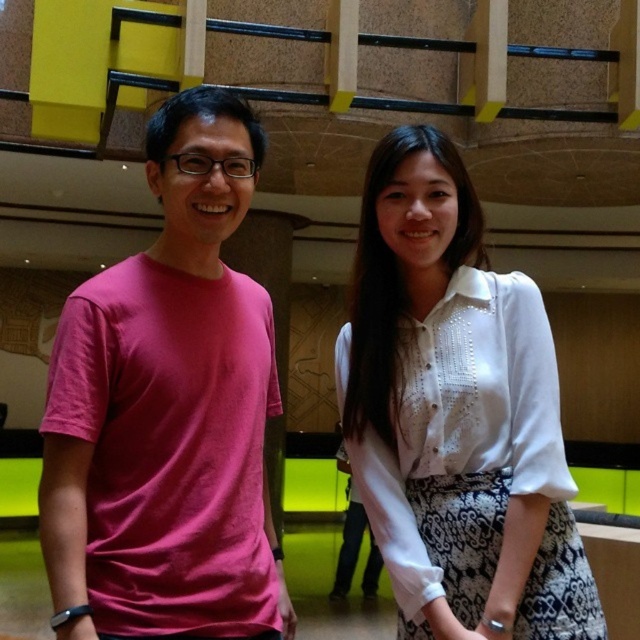
Question: Can you confirm if pink matte t-shirt at left is wider than white textured blouse at center?

Choices:
 (A) yes
 (B) no

Answer: (B)

Question: Which object is closer to the camera taking this photo?

Choices:
 (A) pink matte t-shirt at left
 (B) white textured blouse at center

Answer: (A)

Question: From the image, what is the correct spatial relationship of pink matte t-shirt at left in relation to white textured blouse at center?

Choices:
 (A) above
 (B) below

Answer: (A)

Question: Which point is closer to the camera?

Choices:
 (A) pink matte t-shirt at left
 (B) white textured blouse at center

Answer: (A)

Question: Can you confirm if pink matte t-shirt at left is positioned below white textured blouse at center?

Choices:
 (A) no
 (B) yes

Answer: (A)